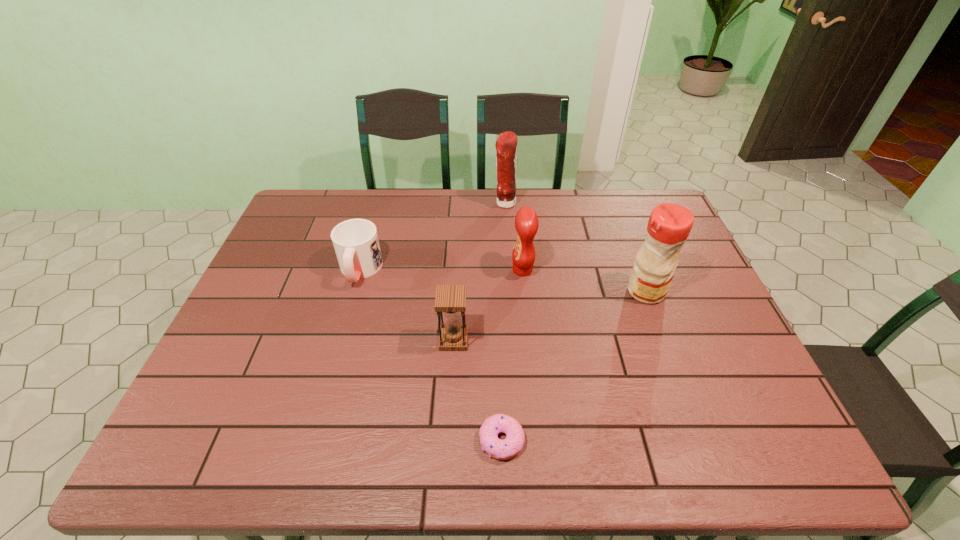
The image size is (960, 540). What are the coordinates of `vacant space that satisfies the following two spatial constraints: 1. on the back side of the rightmost condiment; 2. on the label side of the shortest condiment` in the screenshot? It's located at (637, 270).

Locate an element on the screen. This screenshot has width=960, height=540. vacant position in the image that satisfies the following two spatial constraints: 1. on the side of the rightmost condiment with the handle; 2. on the right side of the mug is located at coordinates (354, 292).

You are a GUI agent. You are given a task and a screenshot of the screen. Output one action in this format:
    pyautogui.click(x=<x>, y=<y>)
    Task: Click on the free space in the image that satisfies the following two spatial constraints: 1. on the side of the shortest object with the handle; 2. on the left side of the second shortest object
    
    Given the screenshot: What is the action you would take?
    pyautogui.click(x=311, y=441)